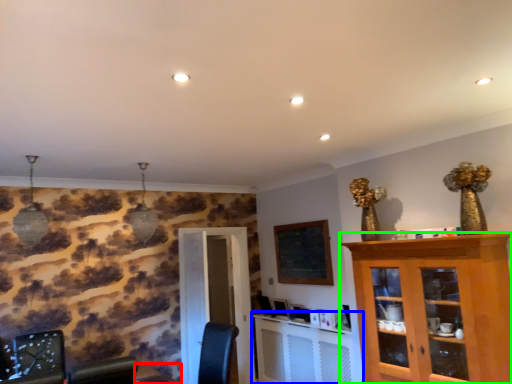
Question: Which is nearer to the table (highlighted by a red box)? computer desk (highlighted by a blue box) or cabinetry (highlighted by a green box).

Choices:
 (A) computer desk
 (B) cabinetry

Answer: (A)